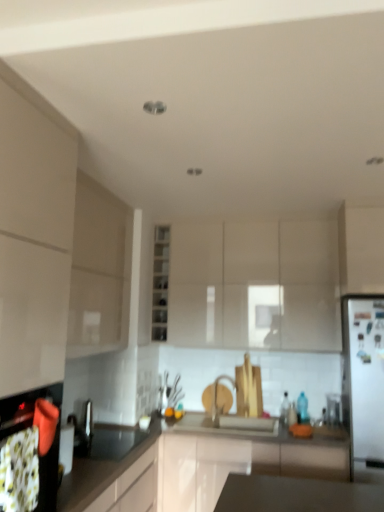
The image size is (384, 512). I want to click on matte beige cabinet at left, which appears as the 2th cabinetry when viewed from the left, so click(99, 271).

Find the location of `black glossy countertop at lower left`. black glossy countertop at lower left is located at coordinates (196, 467).

This screenshot has height=512, width=384. What do you see at coordinates (160, 283) in the screenshot? I see `clear glass shelves at center, arranged as the third cabinetry when viewed from the left` at bounding box center [160, 283].

Describe the element at coordinates (361, 249) in the screenshot. The image size is (384, 512). I see `white glossy cabinet at right, marked as the fifth cabinetry in a left-to-right arrangement` at that location.

Locate an element on the screen. white glossy cabinet at right, marked as the fifth cabinetry in a left-to-right arrangement is located at coordinates (361, 249).

You are a GUI agent. You are given a task and a screenshot of the screen. Output one action in this format:
    pyautogui.click(x=<x>, y=<y>)
    Task: Click on the silver metallic faucet at center
    
    Given the screenshot: What is the action you would take?
    pyautogui.click(x=216, y=396)

The height and width of the screenshot is (512, 384). Describe the element at coordinates (34, 234) in the screenshot. I see `white glossy cabinet at left, which is the first cabinetry in left-to-right order` at that location.

Find the location of a particular element. The height and width of the screenshot is (512, 384). matte black oven at lower left is located at coordinates (29, 425).

What is the approximate width of matte black oven at lower left?

matte black oven at lower left is 34.43 centimeters in width.

Locate an element on the screen. The height and width of the screenshot is (512, 384). matte beige cabinet at left, which appears as the 2th cabinetry when viewed from the left is located at coordinates (99, 271).

Is matte black oven at lower left in front of or behind black glossy countertop at lower left in the image?

In the image, matte black oven at lower left appears in front of black glossy countertop at lower left.

Is matte black oven at lower left shorter than black glossy countertop at lower left?

Indeed, matte black oven at lower left has a lesser height compared to black glossy countertop at lower left.

Looking at this image, from a real-world perspective, is matte black oven at lower left physically below black glossy countertop at lower left?

No, from a real-world perspective, matte black oven at lower left is not below black glossy countertop at lower left.

Looking at this image, is matte black oven at lower left spatially inside black glossy countertop at lower left, or outside of it?

matte black oven at lower left is outside black glossy countertop at lower left.

Which object is positioned more to the left, matte black oven at lower left or matte white cabinet at center, the 4th cabinetry when ordered from left to right?

From the viewer's perspective, matte black oven at lower left appears more on the left side.

Which object is wider, matte black oven at lower left or matte white cabinet at center, marked as the 2th cabinetry in a right-to-left arrangement?

matte white cabinet at center, marked as the 2th cabinetry in a right-to-left arrangement.

Which is behind, point (24, 407) or point (230, 319)?

The point (230, 319) is farther from the camera.

Does matte black oven at lower left touch matte white cabinet at center, marked as the 2th cabinetry in a right-to-left arrangement?

matte black oven at lower left is not next to matte white cabinet at center, marked as the 2th cabinetry in a right-to-left arrangement, and they're not touching.

Considering the sizes of matte white cabinet at center, the 4th cabinetry when ordered from left to right, and matte black oven at lower left in the image, is matte white cabinet at center, the 4th cabinetry when ordered from left to right, bigger or smaller than matte black oven at lower left?

Clearly, matte white cabinet at center, the 4th cabinetry when ordered from left to right, is larger in size than matte black oven at lower left.

Is point (286, 293) in front of point (9, 410)?

No, (286, 293) is further to viewer.

From a real-world perspective, is matte white cabinet at center, the 4th cabinetry when ordered from left to right, positioned over matte black oven at lower left based on gravity?

Yes, from a real-world perspective, matte white cabinet at center, the 4th cabinetry when ordered from left to right, is over matte black oven at lower left

What's the angular difference between matte white cabinet at center, the 4th cabinetry when ordered from left to right, and matte black oven at lower left's facing directions?

There is a 90-degree angle between the facing directions of matte white cabinet at center, the 4th cabinetry when ordered from left to right, and matte black oven at lower left.

In the scene shown: Do you think white glossy cabinet at right, which is the first cabinetry in right-to-left order, is within matte beige cabinet at left, which appears as the 2th cabinetry when viewed from the left, or outside of it?

white glossy cabinet at right, which is the first cabinetry in right-to-left order, is located beyond the bounds of matte beige cabinet at left, which appears as the 2th cabinetry when viewed from the left.

Consider the image. Considering the relative sizes of white glossy cabinet at right, which is the first cabinetry in right-to-left order, and matte beige cabinet at left, which appears as the 2th cabinetry when viewed from the left, in the image provided, is white glossy cabinet at right, which is the first cabinetry in right-to-left order, shorter than matte beige cabinet at left, which appears as the 2th cabinetry when viewed from the left,?

Yes.

Is point (365, 267) closer to viewer compared to point (125, 260)?

Yes.

From a real-world perspective, between white glossy cabinet at right, marked as the fifth cabinetry in a left-to-right arrangement, and matte beige cabinet at left, arranged as the fourth cabinetry when viewed from the right, who is vertically lower?

matte beige cabinet at left, arranged as the fourth cabinetry when viewed from the right.

Is clear glass shelves at center, arranged as the third cabinetry when viewed from the left, at the back of matte white cabinet at center, the 4th cabinetry when ordered from left to right?

That's not correct — matte white cabinet at center, the 4th cabinetry when ordered from left to right, is not looking away from clear glass shelves at center, arranged as the third cabinetry when viewed from the left.

From the image's perspective, between matte white cabinet at center, marked as the 2th cabinetry in a right-to-left arrangement, and clear glass shelves at center, acting as the 3th cabinetry starting from the right, who is located below?

clear glass shelves at center, acting as the 3th cabinetry starting from the right.

Looking at this image, from a real-world perspective, who is located higher, matte white cabinet at center, the 4th cabinetry when ordered from left to right, or clear glass shelves at center, arranged as the third cabinetry when viewed from the left?

clear glass shelves at center, arranged as the third cabinetry when viewed from the left, is physically above.

Is point (182, 298) less distant than point (156, 337)?

No, it is behind (156, 337).

Is matte beige cabinet at left, which appears as the 2th cabinetry when viewed from the left, looking in the opposite direction of silver metallic faucet at center?

No, matte beige cabinet at left, which appears as the 2th cabinetry when viewed from the left, is not facing the opposite direction of silver metallic faucet at center.

From the image's perspective, would you say matte beige cabinet at left, arranged as the fourth cabinetry when viewed from the right, is positioned over silver metallic faucet at center?

Yes.

From the picture: Is matte beige cabinet at left, which appears as the 2th cabinetry when viewed from the left, outside of silver metallic faucet at center?

Yes, matte beige cabinet at left, which appears as the 2th cabinetry when viewed from the left, is not within silver metallic faucet at center.

Who is bigger, matte beige cabinet at left, arranged as the fourth cabinetry when viewed from the right, or silver metallic faucet at center?

matte beige cabinet at left, arranged as the fourth cabinetry when viewed from the right, is bigger.

Based on their positions, is white glossy cabinet at right, marked as the fifth cabinetry in a left-to-right arrangement, located to the left or right of clear glass shelves at center, acting as the 3th cabinetry starting from the right?

Clearly, white glossy cabinet at right, marked as the fifth cabinetry in a left-to-right arrangement, is on the right of clear glass shelves at center, acting as the 3th cabinetry starting from the right, in the image.

From the picture: Considering the sizes of objects white glossy cabinet at right, marked as the fifth cabinetry in a left-to-right arrangement, and clear glass shelves at center, acting as the 3th cabinetry starting from the right, in the image provided, who is taller, white glossy cabinet at right, marked as the fifth cabinetry in a left-to-right arrangement, or clear glass shelves at center, acting as the 3th cabinetry starting from the right,?

clear glass shelves at center, acting as the 3th cabinetry starting from the right.

Between white glossy cabinet at right, marked as the fifth cabinetry in a left-to-right arrangement, and clear glass shelves at center, arranged as the third cabinetry when viewed from the left, which one has smaller size?

With smaller size is clear glass shelves at center, arranged as the third cabinetry when viewed from the left.

Identify the location of oven lying in front of the black glossy countertop at lower left. The height and width of the screenshot is (512, 384). (29, 425).

From a real-world perspective, which cabinetry is the 3rd one above the matte black oven at lower left? Please provide its 2D coordinates.

[(254, 282)]

Based on their spatial positions, is matte white cabinet at center, marked as the 2th cabinetry in a right-to-left arrangement, or silver metallic faucet at center closer to black glossy countertop at lower left?

silver metallic faucet at center lies closer to black glossy countertop at lower left than the other object.

Looking at the image, which one is located closer to white glossy cabinet at left, which is the first cabinetry in left-to-right order, matte white cabinet at center, marked as the 2th cabinetry in a right-to-left arrangement, or clear glass shelves at center, arranged as the third cabinetry when viewed from the left?

Based on the image, clear glass shelves at center, arranged as the third cabinetry when viewed from the left, appears to be nearer to white glossy cabinet at left, which is the first cabinetry in left-to-right order.

Based on their spatial positions, is white glossy cabinet at left, which is the first cabinetry in left-to-right order, or matte beige cabinet at left, which appears as the 2th cabinetry when viewed from the left, closer to white glossy cabinet at right, which is the first cabinetry in right-to-left order?

The object closer to white glossy cabinet at right, which is the first cabinetry in right-to-left order, is matte beige cabinet at left, which appears as the 2th cabinetry when viewed from the left.

From the image, which object appears to be nearer to matte black oven at lower left, matte white cabinet at center, the 4th cabinetry when ordered from left to right, or black glossy countertop at lower left?

Among the two, black glossy countertop at lower left is located nearer to matte black oven at lower left.

Considering their positions, is silver metallic faucet at center positioned closer to white glossy cabinet at right, which is the first cabinetry in right-to-left order, than matte white cabinet at center, marked as the 2th cabinetry in a right-to-left arrangement?

The object closer to white glossy cabinet at right, which is the first cabinetry in right-to-left order, is matte white cabinet at center, marked as the 2th cabinetry in a right-to-left arrangement.

Which object lies nearer to the anchor point white glossy refrigerator at right, matte black oven at lower left or clear glass shelves at center, acting as the 3th cabinetry starting from the right?

Among the two, clear glass shelves at center, acting as the 3th cabinetry starting from the right, is located nearer to white glossy refrigerator at right.

Looking at the image, which one is located closer to clear glass shelves at center, arranged as the third cabinetry when viewed from the left, matte beige cabinet at left, arranged as the fourth cabinetry when viewed from the right, or matte white cabinet at center, marked as the 2th cabinetry in a right-to-left arrangement?

matte white cabinet at center, marked as the 2th cabinetry in a right-to-left arrangement, is closer to clear glass shelves at center, arranged as the third cabinetry when viewed from the left.

When comparing their distances from matte white cabinet at center, the 4th cabinetry when ordered from left to right, does clear glass shelves at center, arranged as the third cabinetry when viewed from the left, or matte beige cabinet at left, which appears as the 2th cabinetry when viewed from the left, seem closer?

clear glass shelves at center, arranged as the third cabinetry when viewed from the left, lies closer to matte white cabinet at center, the 4th cabinetry when ordered from left to right, than the other object.

At what (x,y) coordinates should I click in order to perform the action: click on tap located between matte beige cabinet at left, which appears as the 2th cabinetry when viewed from the left, and white glossy refrigerator at right in the left-right direction. Please return your answer as a coordinate pair (x, y). Looking at the image, I should click on (216, 396).

At what (x,y) coordinates should I click in order to perform the action: click on fridge between matte black oven at lower left and silver metallic faucet at center along the z-axis. Please return your answer as a coordinate pair (x, y). Looking at the image, I should click on (363, 377).

The height and width of the screenshot is (512, 384). I want to click on tap between clear glass shelves at center, arranged as the third cabinetry when viewed from the left, and white glossy cabinet at right, marked as the fifth cabinetry in a left-to-right arrangement, in the horizontal direction, so click(x=216, y=396).

Find the location of `countertop situated between matte black oven at lower left and white glossy cabinet at right, marked as the fifth cabinetry in a left-to-right arrangement, from left to right`. countertop situated between matte black oven at lower left and white glossy cabinet at right, marked as the fifth cabinetry in a left-to-right arrangement, from left to right is located at coordinates (196, 467).